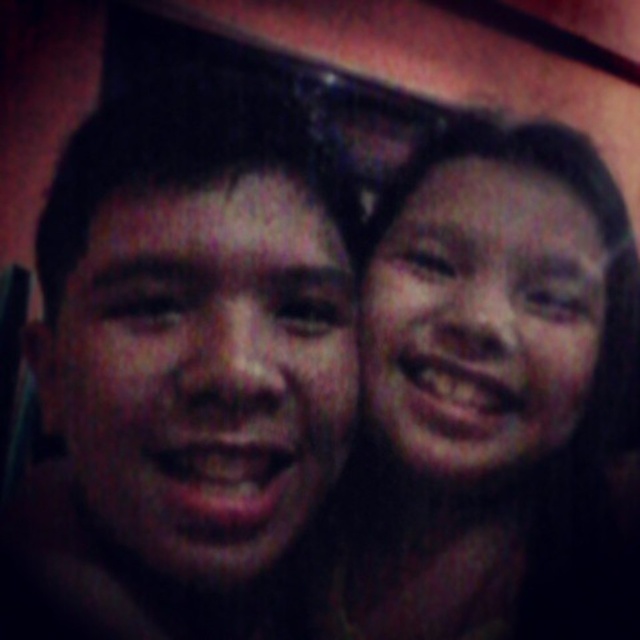
Question: Among these objects, which one is farthest from the camera?

Choices:
 (A) smooth skin at right
 (B) smooth skin face at right
 (C) smooth skin face at center

Answer: (B)

Question: Is smooth skin at right to the right of smooth skin face at right from the viewer's perspective?

Choices:
 (A) yes
 (B) no

Answer: (A)

Question: Which of these objects is positioned closest to the smooth skin face at right?

Choices:
 (A) smooth skin at right
 (B) smooth skin face at center

Answer: (A)

Question: Does smooth skin at right have a greater width compared to smooth skin face at center?

Choices:
 (A) no
 (B) yes

Answer: (B)

Question: Which point is farther from the camera taking this photo?

Choices:
 (A) (506, 458)
 (B) (236, 211)
 (C) (516, 460)

Answer: (C)

Question: Is smooth skin face at center positioned behind smooth skin face at right?

Choices:
 (A) no
 (B) yes

Answer: (A)